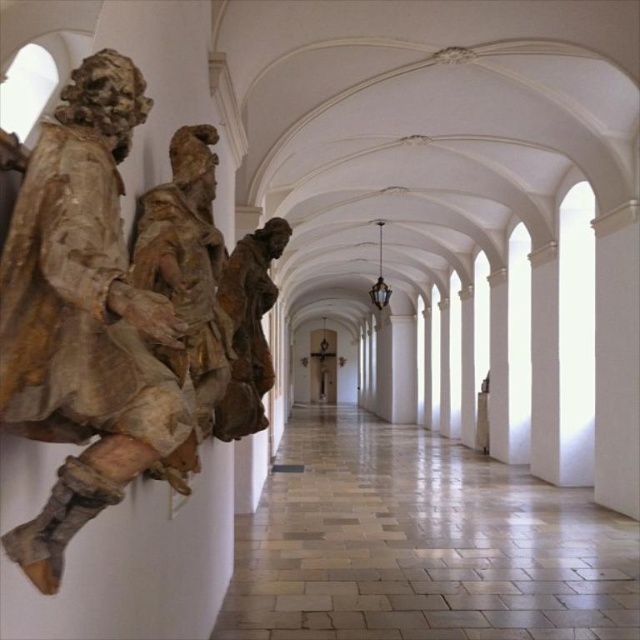
Question: Is wooden statue at left thinner than matte brown statue at center?

Choices:
 (A) no
 (B) yes

Answer: (B)

Question: Among these points, which one is nearest to the camera?

Choices:
 (A) (97, 352)
 (B) (228, 285)

Answer: (A)

Question: Does brown textured statue at center appear on the left side of matte brown statue at center?

Choices:
 (A) yes
 (B) no

Answer: (A)

Question: Which point appears farthest from the camera in this image?

Choices:
 (A) (x=262, y=340)
 (B) (x=184, y=484)

Answer: (A)

Question: Which object appears farthest from the camera in this image?

Choices:
 (A) wooden statue at left
 (B) brown textured statue at center
 (C) matte brown statue at center

Answer: (C)

Question: Is brown textured statue at center further to the viewer compared to matte brown statue at center?

Choices:
 (A) yes
 (B) no

Answer: (B)